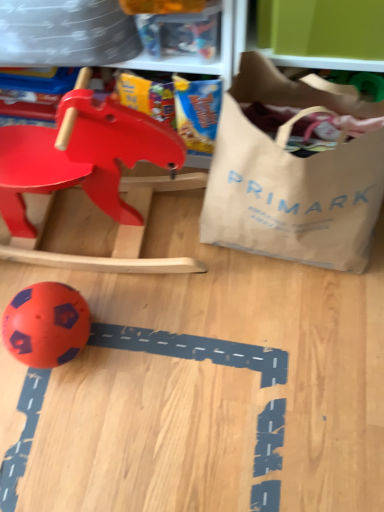
The height and width of the screenshot is (512, 384). I want to click on vacant space in front of orange rubber ball at lower left, the 2th toy positioned from the top, so click(x=62, y=413).